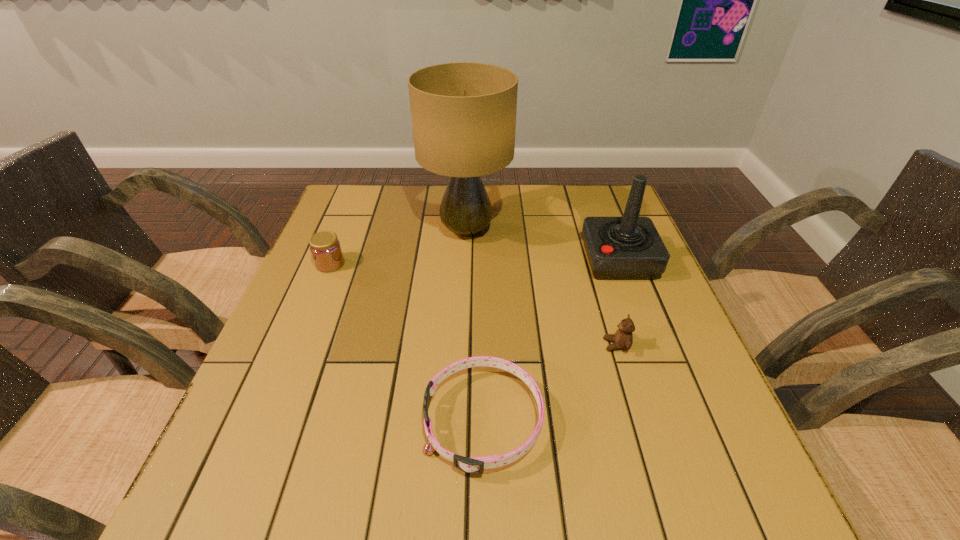
Locate an element on the screen. vacant region located 0.180m on the front of the leftmost object is located at coordinates (305, 327).

The width and height of the screenshot is (960, 540). I want to click on free location located 0.170m at the face of the fourth farthest object, so click(524, 345).

The height and width of the screenshot is (540, 960). Identify the location of vacant space located 0.150m at the face of the fourth farthest object. (533, 345).

The height and width of the screenshot is (540, 960). Identify the location of free space located at the face of the fourth farthest object. (462, 345).

This screenshot has height=540, width=960. In order to click on vacant position located 0.200m with the buckle on the nearest object in this screenshot , I will do (x=315, y=421).

I want to click on free region located with the buckle on the nearest object, so click(359, 421).

The image size is (960, 540). Find the location of `free space located with the buckle on the nearest object`. free space located with the buckle on the nearest object is located at coordinates pos(337,421).

The image size is (960, 540). Identify the location of object located in the far edge section of the desktop. (463, 114).

The height and width of the screenshot is (540, 960). In order to click on object that is at the near edge in this screenshot , I will do [x=474, y=465].

At what (x,y) coordinates should I click in order to perform the action: click on object present at the left edge. Please return your answer as a coordinate pair (x, y). Looking at the image, I should click on (326, 251).